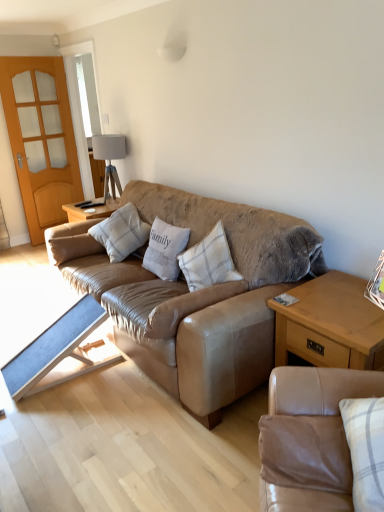
At what (x,y) coordinates should I click in order to perform the action: click on free space in front of blue fabric table at lower left, which appears as the 2th table when viewed from the right. Please return your answer as a coordinate pair (x, y). Looking at the image, I should click on (60, 418).